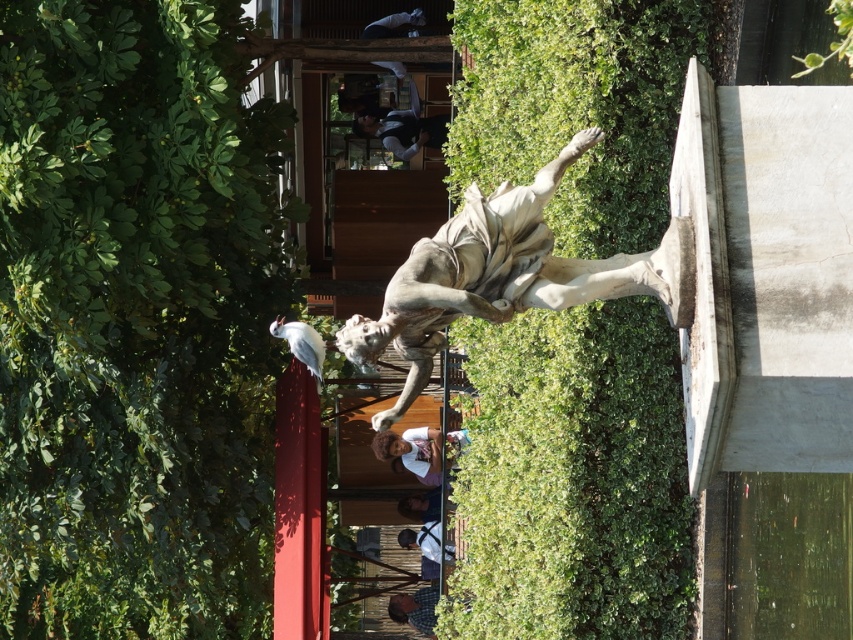
Is point (0, 449) less distant than point (476, 477)?

That is True.

The width and height of the screenshot is (853, 640). Describe the element at coordinates (135, 321) in the screenshot. I see `green leafy hedge at upper left` at that location.

This screenshot has height=640, width=853. I want to click on green leafy hedge at upper left, so click(x=135, y=321).

How much distance is there between white matte shirt at center and smooth brown hair at center?

white matte shirt at center and smooth brown hair at center are 6.33 feet apart from each other.

Is white matte shirt at center to the right of smooth brown hair at center from the viewer's perspective?

Indeed, white matte shirt at center is positioned on the right side of smooth brown hair at center.

The width and height of the screenshot is (853, 640). Find the location of `white matte shirt at center`. white matte shirt at center is located at coordinates (412, 451).

Between green leafy hedge at upper left and white marble statue at center, which one has more height?

With more height is green leafy hedge at upper left.

Between green leafy hedge at upper left and white marble statue at center, which one is positioned higher?

green leafy hedge at upper left is above.

Identify the location of green leafy hedge at upper left. The height and width of the screenshot is (640, 853). (135, 321).